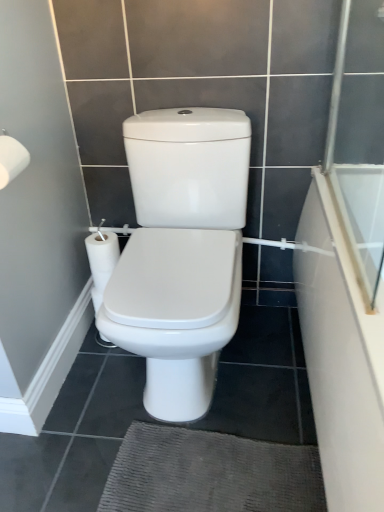
Question: Considering the relative sizes of white matte toilet paper at upper left and transparent glass screen door at right in the image provided, is white matte toilet paper at upper left taller than transparent glass screen door at right?

Choices:
 (A) no
 (B) yes

Answer: (A)

Question: Considering the relative sizes of white matte toilet paper at upper left and transparent glass screen door at right in the image provided, is white matte toilet paper at upper left bigger than transparent glass screen door at right?

Choices:
 (A) yes
 (B) no

Answer: (B)

Question: Is white matte toilet paper at upper left to the left of transparent glass screen door at right from the viewer's perspective?

Choices:
 (A) no
 (B) yes

Answer: (B)

Question: Can you confirm if white matte toilet paper at upper left is positioned to the right of transparent glass screen door at right?

Choices:
 (A) no
 (B) yes

Answer: (A)

Question: Considering the relative sizes of white matte toilet paper at upper left and transparent glass screen door at right in the image provided, is white matte toilet paper at upper left shorter than transparent glass screen door at right?

Choices:
 (A) yes
 (B) no

Answer: (A)

Question: Is white matte toilet paper at upper left positioned far away from transparent glass screen door at right?

Choices:
 (A) yes
 (B) no

Answer: (B)

Question: Does transparent glass screen door at right lie in front of white matte toilet paper at upper left?

Choices:
 (A) no
 (B) yes

Answer: (B)

Question: Can you confirm if transparent glass screen door at right is positioned to the right of white matte toilet paper at upper left?

Choices:
 (A) no
 (B) yes

Answer: (B)

Question: From a real-world perspective, is transparent glass screen door at right physically below white matte toilet paper at upper left?

Choices:
 (A) yes
 (B) no

Answer: (B)

Question: Is transparent glass screen door at right shorter than white matte toilet paper at upper left?

Choices:
 (A) yes
 (B) no

Answer: (B)

Question: Is white matte toilet paper at upper left at the back of transparent glass screen door at right?

Choices:
 (A) no
 (B) yes

Answer: (A)

Question: Does transparent glass screen door at right come behind white matte toilet paper at upper left?

Choices:
 (A) yes
 (B) no

Answer: (B)

Question: Is white glossy bathtub at right facing away from white matte toilet paper at upper left?

Choices:
 (A) yes
 (B) no

Answer: (B)